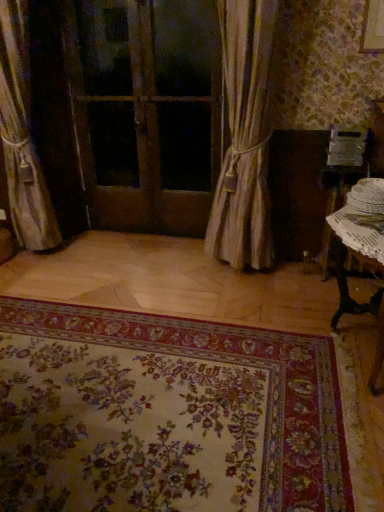
Question: Is silky beige curtain at left, which appears as the second curtain when viewed from the right, smaller than silky beige curtain at center, which is the first curtain from right to left?

Choices:
 (A) yes
 (B) no

Answer: (A)

Question: From a real-world perspective, is silky beige curtain at left, which ranks as the 1th curtain in left-to-right order, beneath silky beige curtain at center, positioned as the 2th curtain in left-to-right order?

Choices:
 (A) yes
 (B) no

Answer: (B)

Question: Is silky beige curtain at left, which ranks as the 1th curtain in left-to-right order, not close to silky beige curtain at center, positioned as the 2th curtain in left-to-right order?

Choices:
 (A) yes
 (B) no

Answer: (A)

Question: Is silky beige curtain at left, which appears as the second curtain when viewed from the right, taller than silky beige curtain at center, which is the first curtain from right to left?

Choices:
 (A) no
 (B) yes

Answer: (B)

Question: From a real-world perspective, is silky beige curtain at left, which ranks as the 1th curtain in left-to-right order, on silky beige curtain at center, which is the first curtain from right to left?

Choices:
 (A) no
 (B) yes

Answer: (B)

Question: Is wooden door at center inside the boundaries of floral carpet at lower center, or outside?

Choices:
 (A) outside
 (B) inside

Answer: (A)

Question: Considering the relative positions of wooden door at center and floral carpet at lower center in the image provided, is wooden door at center to the left or to the right of floral carpet at lower center?

Choices:
 (A) right
 (B) left

Answer: (A)

Question: Considering the positions of wooden door at center and floral carpet at lower center in the image, is wooden door at center bigger or smaller than floral carpet at lower center?

Choices:
 (A) big
 (B) small

Answer: (B)

Question: Is wooden door at center wider or thinner than floral carpet at lower center?

Choices:
 (A) wide
 (B) thin

Answer: (B)

Question: From a real-world perspective, relative to white lace table at right, which appears as the first table when viewed from the back, is wooden door at center vertically above or below?

Choices:
 (A) below
 (B) above

Answer: (B)

Question: Is wooden door at center wider or thinner than white lace table at right, arranged as the 2th table when viewed from the front?

Choices:
 (A) wide
 (B) thin

Answer: (B)

Question: Considering the positions of point (173, 166) and point (362, 163), is point (173, 166) closer or farther from the camera than point (362, 163)?

Choices:
 (A) closer
 (B) farther

Answer: (B)

Question: Considering the positions of wooden door at center and white lace table at right, arranged as the 2th table when viewed from the front, in the image, is wooden door at center taller or shorter than white lace table at right, arranged as the 2th table when viewed from the front,?

Choices:
 (A) short
 (B) tall

Answer: (B)

Question: Is white lace table at right, which appears as the first table when viewed from the back, situated inside white wicker table at lower right, which appears as the first table when viewed from the front, or outside?

Choices:
 (A) inside
 (B) outside

Answer: (B)

Question: From a real-world perspective, is white lace table at right, arranged as the 2th table when viewed from the front, above or below white wicker table at lower right, the second table from the back?

Choices:
 (A) below
 (B) above

Answer: (A)